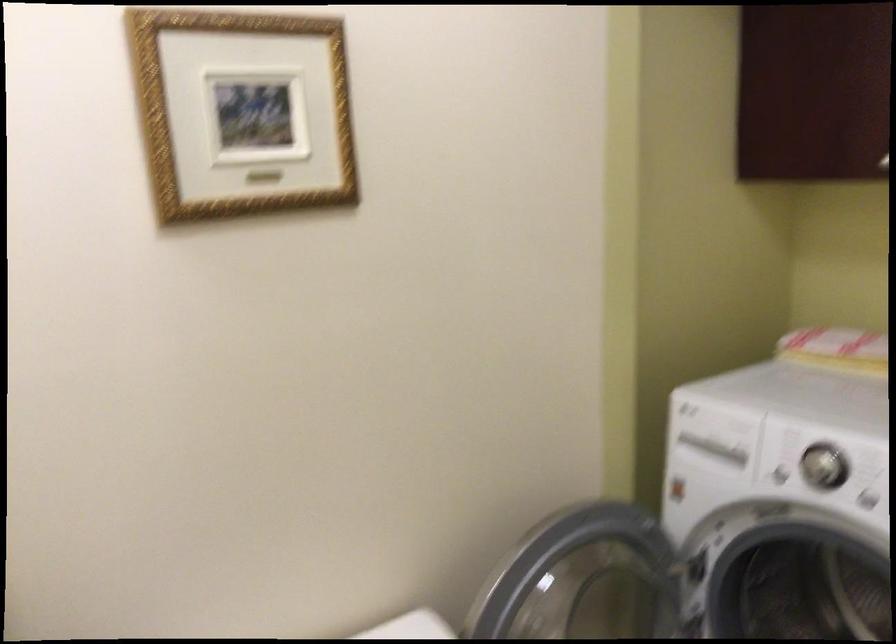
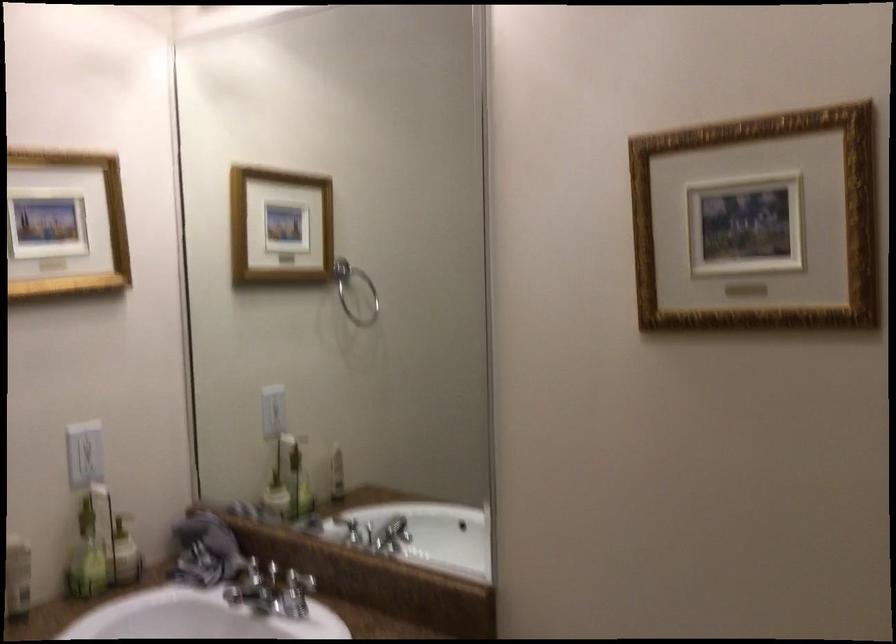
Question: Based on the continuous images, in which direction is the camera rotating? Reply with the corresponding letter.

Choices:
 (A) Left
 (B) Right
 (C) Up
 (D) Down

Answer: (A)